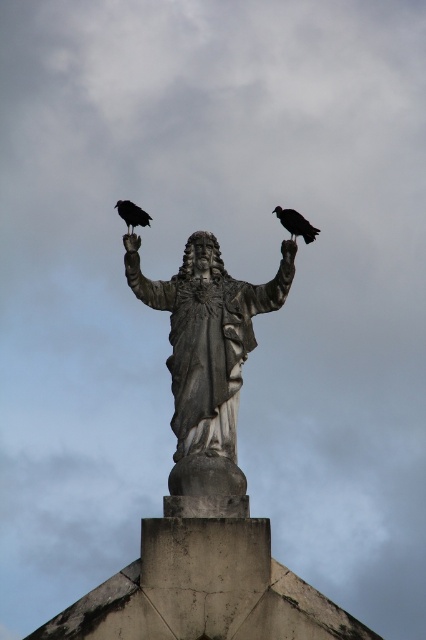
You are a drone operator trying to capture a closeup of the statue. Your drone is currently at point (296, 224). You want to move it to the statue. Which direction should you move the drone to get closer to the statue?

The point (296, 224) is where the black matte raven at upper right is located. To move the drone closer to the statue, you should move it away from the black matte raven at upper right towards the statue.

You are a bird enthusiast observing the gray stone statue at center and the black matte raven at upper right. Which object is bigger in size?

The gray stone statue at center is larger in size compared to the black matte raven at upper right.

You are a birdwatcher observing the scene from the ground. You notice the gray stone statue at center and the black matte raven at upper left. Which object is positioned higher in the image?

The black matte raven at upper left is positioned higher than the gray stone statue at center, as the statue is located below the raven.